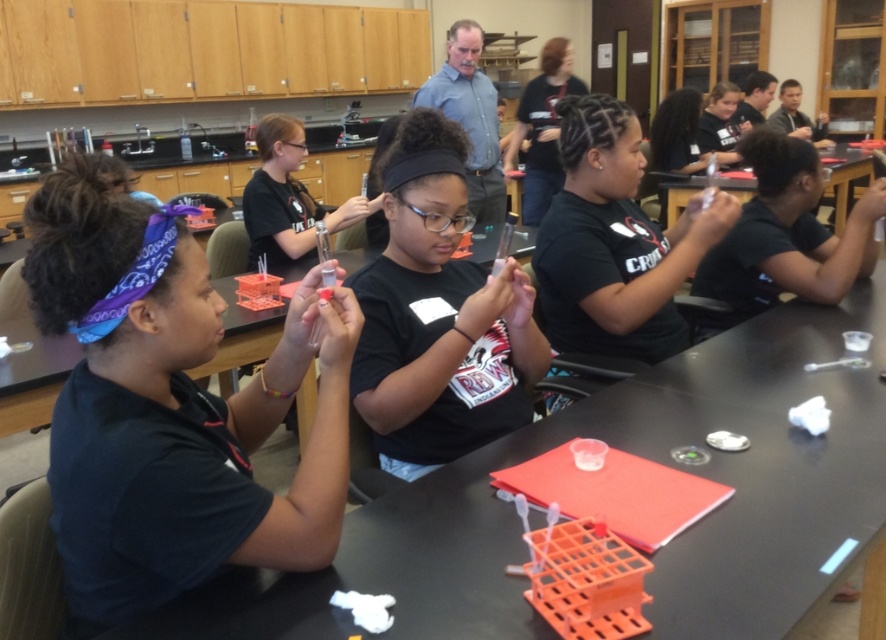
Where is the black matte shirt at center located in the image?

The black matte shirt at center is located at point (438, 316) in the image.